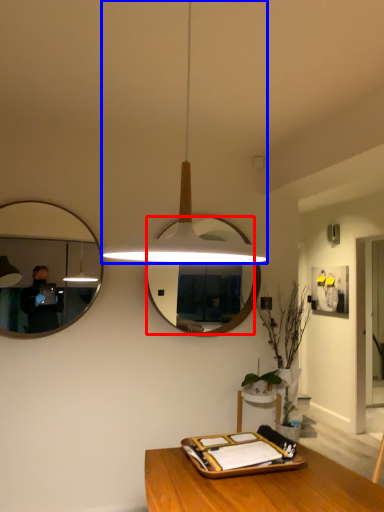
Question: Which of the following is the farthest to the observer, mirror (highlighted by a red box) or lamp (highlighted by a blue box)?

Choices:
 (A) mirror
 (B) lamp

Answer: (A)